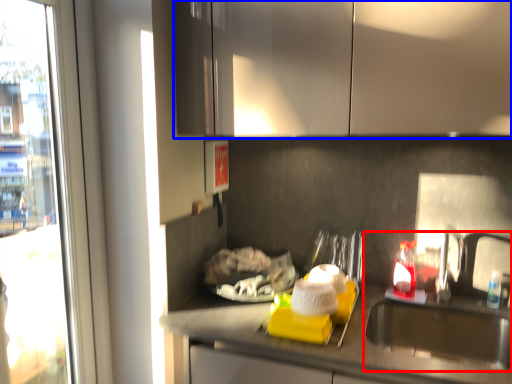
Question: Which object is further to the camera taking this photo, sink (highlighted by a red box) or cabinetry (highlighted by a blue box)?

Choices:
 (A) sink
 (B) cabinetry

Answer: (A)